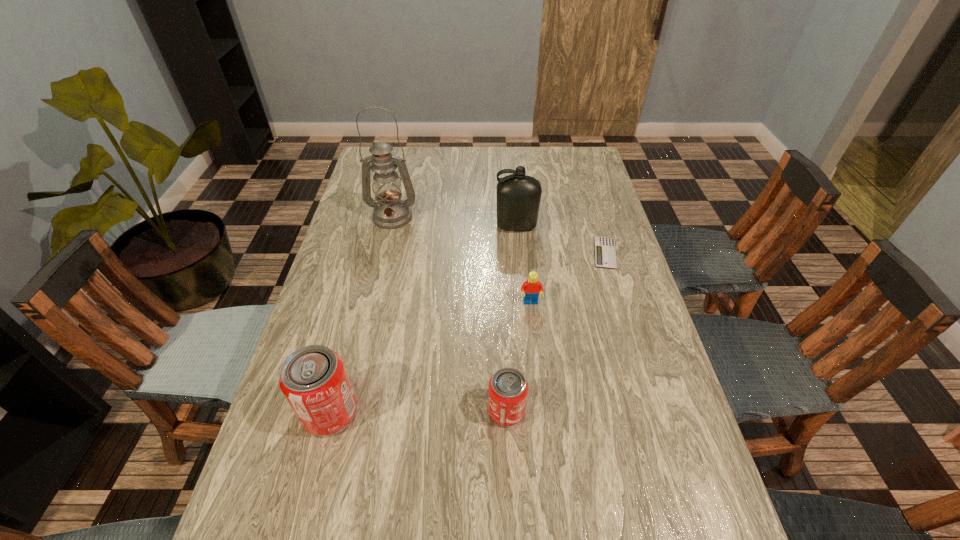
What are the coordinates of `free space between the tallest object and the Lego` in the screenshot? It's located at (462, 260).

This screenshot has height=540, width=960. Identify the location of object that is the third closest one to the tallest object. (605, 253).

In order to click on the third closest object to the bottle in this screenshot , I will do `click(532, 287)`.

Where is `free spot that satisfies the following two spatial constraints: 1. on the front side of the bottle; 2. on the left side of the oil lamp`? free spot that satisfies the following two spatial constraints: 1. on the front side of the bottle; 2. on the left side of the oil lamp is located at coordinates (391, 226).

The width and height of the screenshot is (960, 540). Find the location of `free location that satisfies the following two spatial constraints: 1. on the back side of the fourth shortest object; 2. on the right side of the fourth nearest object`. free location that satisfies the following two spatial constraints: 1. on the back side of the fourth shortest object; 2. on the right side of the fourth nearest object is located at coordinates (372, 253).